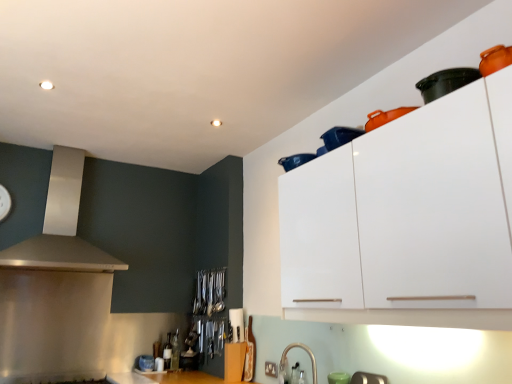
Question: Is satin nickel faucet at lower center, the second appliance positioned from the back, not close to satin silver vent at upper left?

Choices:
 (A) yes
 (B) no

Answer: (A)

Question: Is satin nickel faucet at lower center, placed as the second appliance when sorted from bottom to top, taller than satin silver vent at upper left?

Choices:
 (A) yes
 (B) no

Answer: (B)

Question: Considering the relative positions of satin nickel faucet at lower center, the 2th appliance in the top-to-bottom sequence, and satin silver vent at upper left in the image provided, is satin nickel faucet at lower center, the 2th appliance in the top-to-bottom sequence, in front of satin silver vent at upper left?

Choices:
 (A) no
 (B) yes

Answer: (B)

Question: Considering the relative sizes of satin nickel faucet at lower center, the second appliance positioned from the back, and satin silver vent at upper left in the image provided, is satin nickel faucet at lower center, the second appliance positioned from the back, shorter than satin silver vent at upper left?

Choices:
 (A) no
 (B) yes

Answer: (B)

Question: Is satin nickel faucet at lower center, the 2th appliance in the top-to-bottom sequence, facing towards satin silver vent at upper left?

Choices:
 (A) yes
 (B) no

Answer: (B)

Question: Does satin nickel faucet at lower center, the second appliance positioned from the back, have a greater width compared to satin silver vent at upper left?

Choices:
 (A) no
 (B) yes

Answer: (A)

Question: Can you confirm if white glossy cabinet at upper right is positioned to the left of satin nickel faucet at lower center, the second appliance when ordered from right to left?

Choices:
 (A) yes
 (B) no

Answer: (B)

Question: Does white glossy cabinet at upper right have a greater width compared to satin nickel faucet at lower center, the second appliance positioned from the back?

Choices:
 (A) yes
 (B) no

Answer: (A)

Question: Is satin nickel faucet at lower center, the second appliance when ordered from right to left, at the back of white glossy cabinet at upper right?

Choices:
 (A) no
 (B) yes

Answer: (A)

Question: Is white glossy cabinet at upper right bigger than satin nickel faucet at lower center, placed as the second appliance when sorted from bottom to top?

Choices:
 (A) no
 (B) yes

Answer: (B)

Question: From the image's perspective, is white glossy cabinet at upper right located above satin nickel faucet at lower center, the second appliance positioned from the back?

Choices:
 (A) yes
 (B) no

Answer: (A)

Question: From a real-world perspective, is white glossy cabinet at upper right physically above satin nickel faucet at lower center, which is counted as the second appliance, starting from the left?

Choices:
 (A) no
 (B) yes

Answer: (B)

Question: Is satin silver vent at upper left not close to metallic silver gas stove at lower left?

Choices:
 (A) yes
 (B) no

Answer: (A)